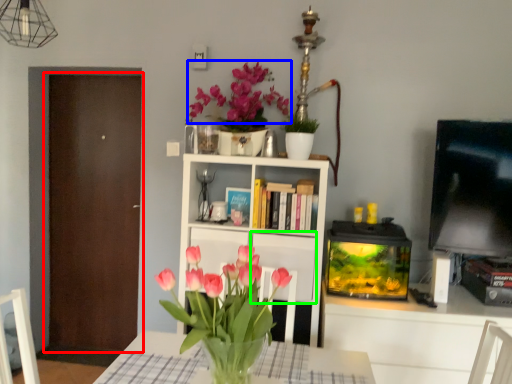
Question: Which object is the closest to the door (highlighted by a red box)? Choose among these: flower (highlighted by a blue box) or cabinet (highlighted by a green box).

Choices:
 (A) flower
 (B) cabinet

Answer: (A)